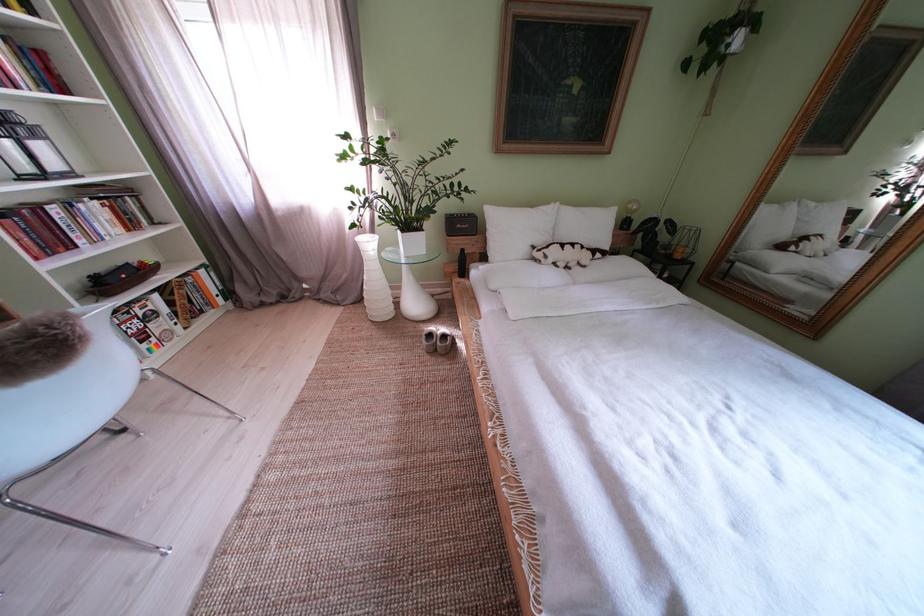
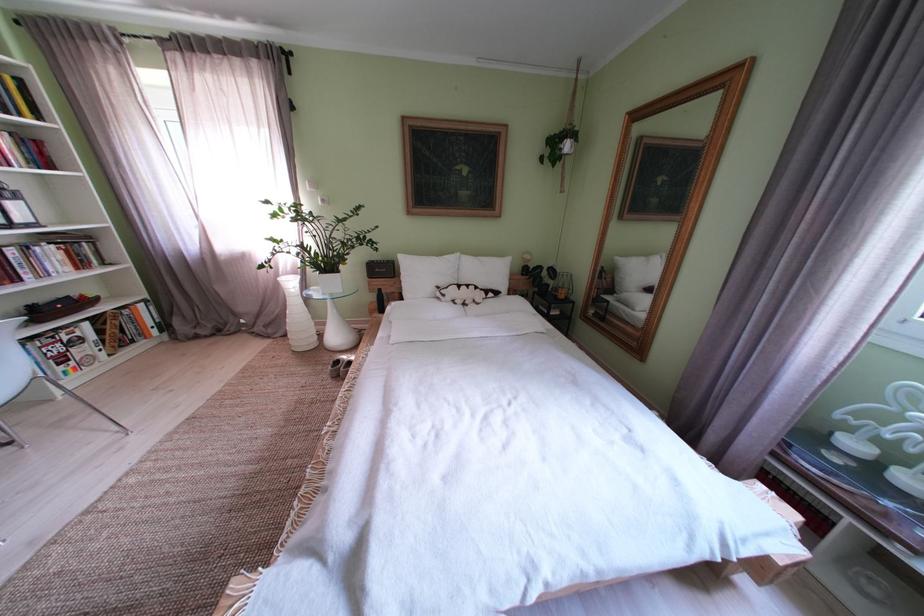
Question: I am providing you with two images of the same scene from different viewpoints. After the viewpoint changes to image2, which objects are now occluded?

Choices:
 (A) white textured vase
 (B) stuffed animal toy
 (C) white pillow
 (D) none of these

Answer: (D)